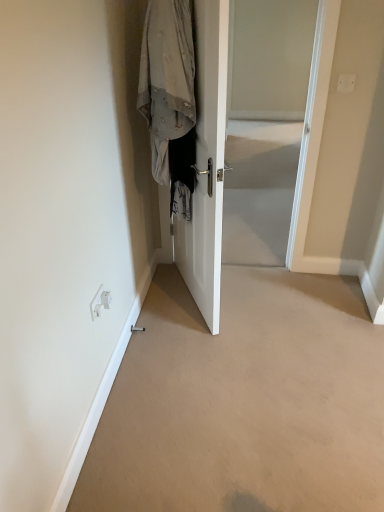
Identify the location of free area below light gray fabric coat at center (from a real-world perspective). The image size is (384, 512). (181, 298).